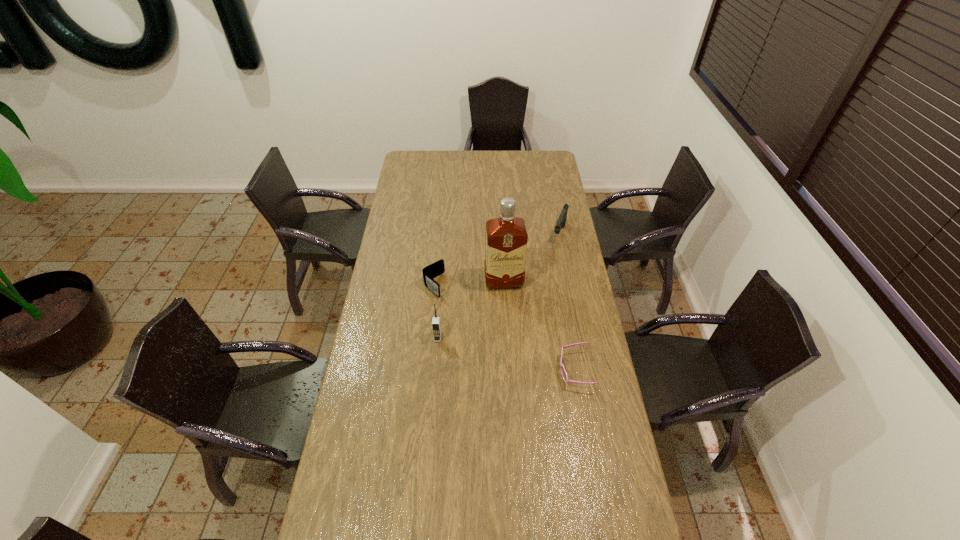
You are a GUI agent. You are given a task and a screenshot of the screen. Output one action in this format:
    pyautogui.click(x=<x>, y=<y>)
    Task: Click on the vacant region located 0.390m at the barrel of the third tallest object
    The width and height of the screenshot is (960, 540).
    Given the screenshot: What is the action you would take?
    pyautogui.click(x=536, y=302)

Locate an element on the screen. Image resolution: width=960 pixels, height=540 pixels. vacant space located 0.200m at the barrel of the third tallest object is located at coordinates (547, 273).

Where is `sunglasses that is at the right edge`? This screenshot has width=960, height=540. sunglasses that is at the right edge is located at coordinates click(x=564, y=374).

At what (x,y) coordinates should I click in order to perform the action: click on pistol at the right edge. Please return your answer as a coordinate pair (x, y). The image size is (960, 540). Looking at the image, I should click on (561, 221).

Where is `free space at the far edge`? This screenshot has width=960, height=540. free space at the far edge is located at coordinates (496, 159).

Locate an element on the screen. The height and width of the screenshot is (540, 960). free space at the left edge of the desktop is located at coordinates (387, 321).

The width and height of the screenshot is (960, 540). What are the coordinates of `free space at the right edge` in the screenshot? It's located at (544, 195).

This screenshot has height=540, width=960. Find the location of `vacant area at the far left corner`. vacant area at the far left corner is located at coordinates (411, 154).

Locate an element on the screen. The width and height of the screenshot is (960, 540). vacant space at the near left corner of the desktop is located at coordinates (348, 517).

The width and height of the screenshot is (960, 540). What are the coordinates of `free space between the liquor and the shortest object` in the screenshot? It's located at (540, 326).